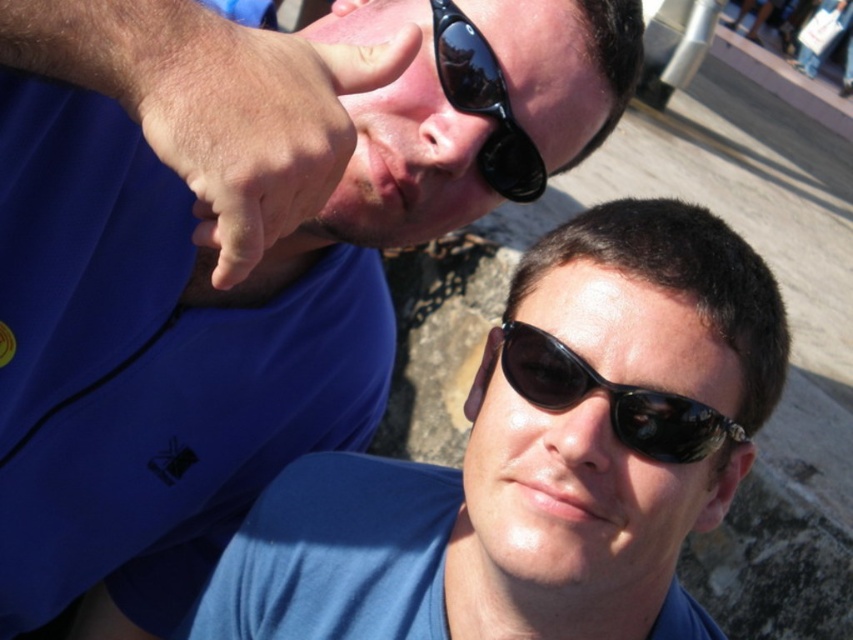
You are taking a photo of two people standing in front of you. The first person is at point (161, 150) and the second is at point (631, 390). Which person is closer to your camera?

The person at point (161, 150) is closer to the camera than the person at point (631, 390).